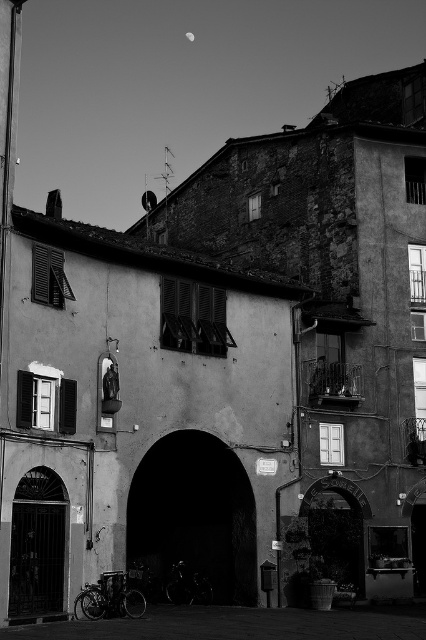
Question: Among these objects, which one is farthest from the camera?

Choices:
 (A) smooth concrete alley at lower center
 (B) dark stone archway at center

Answer: (B)

Question: Is dark stone archway at center positioned behind smooth concrete alley at lower center?

Choices:
 (A) no
 (B) yes

Answer: (B)

Question: Is dark stone archway at center wider than smooth concrete alley at lower center?

Choices:
 (A) no
 (B) yes

Answer: (A)

Question: Can you confirm if dark stone archway at center is positioned below smooth concrete alley at lower center?

Choices:
 (A) yes
 (B) no

Answer: (B)

Question: Which point appears farthest from the camera in this image?

Choices:
 (A) (198, 524)
 (B) (294, 632)

Answer: (A)